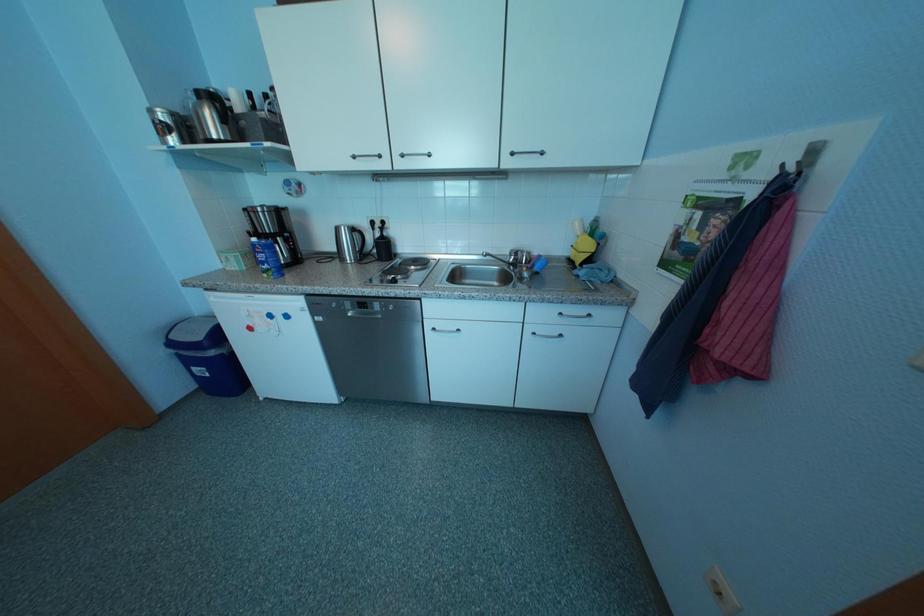
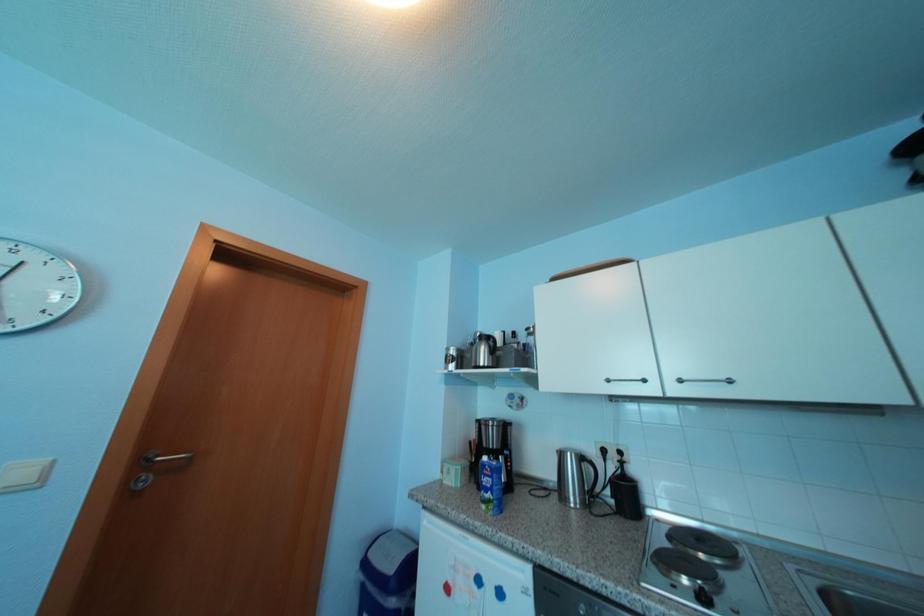
The first image is from the beginning of the video and the second image is from the end. How did the camera likely rotate when shooting the video?

The camera's rotation is toward left-up.